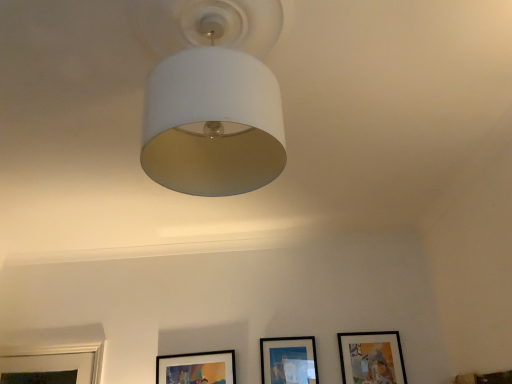
Question: Is matte black picture frame at lower right, which ranks as the first picture frame in right-to-left order, shorter than matte black picture frame at lower center, marked as the 1th picture frame in a left-to-right arrangement?

Choices:
 (A) no
 (B) yes

Answer: (A)

Question: Is matte black picture frame at lower right, which ranks as the first picture frame in right-to-left order, far away from matte black picture frame at lower center, which is counted as the 3th picture frame, starting from the right?

Choices:
 (A) no
 (B) yes

Answer: (B)

Question: Is matte black picture frame at lower right, which ranks as the first picture frame in right-to-left order, at the right side of matte black picture frame at lower center, marked as the 1th picture frame in a left-to-right arrangement?

Choices:
 (A) yes
 (B) no

Answer: (A)

Question: Can you confirm if matte black picture frame at lower right, which ranks as the first picture frame in right-to-left order, is bigger than matte black picture frame at lower center, which is counted as the 3th picture frame, starting from the right?

Choices:
 (A) no
 (B) yes

Answer: (B)

Question: Is matte black picture frame at lower right, positioned as the 3th picture frame in left-to-right order, thinner than matte black picture frame at lower center, marked as the 1th picture frame in a left-to-right arrangement?

Choices:
 (A) no
 (B) yes

Answer: (B)

Question: Does matte black picture frame at lower right, positioned as the 3th picture frame in left-to-right order, contain matte black picture frame at lower center, which is counted as the 3th picture frame, starting from the right?

Choices:
 (A) no
 (B) yes

Answer: (A)

Question: Can you confirm if matte black picture frame at center, the 2th picture frame in the right-to-left sequence, is bigger than matte black picture frame at lower right, which ranks as the first picture frame in right-to-left order?

Choices:
 (A) no
 (B) yes

Answer: (A)

Question: Is matte black picture frame at center, the 2th picture frame in the right-to-left sequence, looking in the opposite direction of matte black picture frame at lower right, which ranks as the first picture frame in right-to-left order?

Choices:
 (A) yes
 (B) no

Answer: (B)

Question: Considering the relative sizes of matte black picture frame at center, the 2th picture frame positioned from the left, and matte black picture frame at lower right, positioned as the 3th picture frame in left-to-right order, in the image provided, is matte black picture frame at center, the 2th picture frame positioned from the left, shorter than matte black picture frame at lower right, positioned as the 3th picture frame in left-to-right order,?

Choices:
 (A) no
 (B) yes

Answer: (B)

Question: From a real-world perspective, is matte black picture frame at center, the 2th picture frame in the right-to-left sequence, physically below matte black picture frame at lower right, positioned as the 3th picture frame in left-to-right order?

Choices:
 (A) no
 (B) yes

Answer: (A)

Question: Are matte black picture frame at center, the 2th picture frame in the right-to-left sequence, and matte black picture frame at lower right, positioned as the 3th picture frame in left-to-right order, beside each other?

Choices:
 (A) no
 (B) yes

Answer: (A)

Question: Is the position of matte black picture frame at center, the 2th picture frame in the right-to-left sequence, more distant than that of matte black picture frame at lower right, positioned as the 3th picture frame in left-to-right order?

Choices:
 (A) yes
 (B) no

Answer: (A)

Question: Is matte black picture frame at lower center, marked as the 1th picture frame in a left-to-right arrangement, further to the viewer compared to matte black picture frame at center, the 2th picture frame positioned from the left?

Choices:
 (A) yes
 (B) no

Answer: (A)